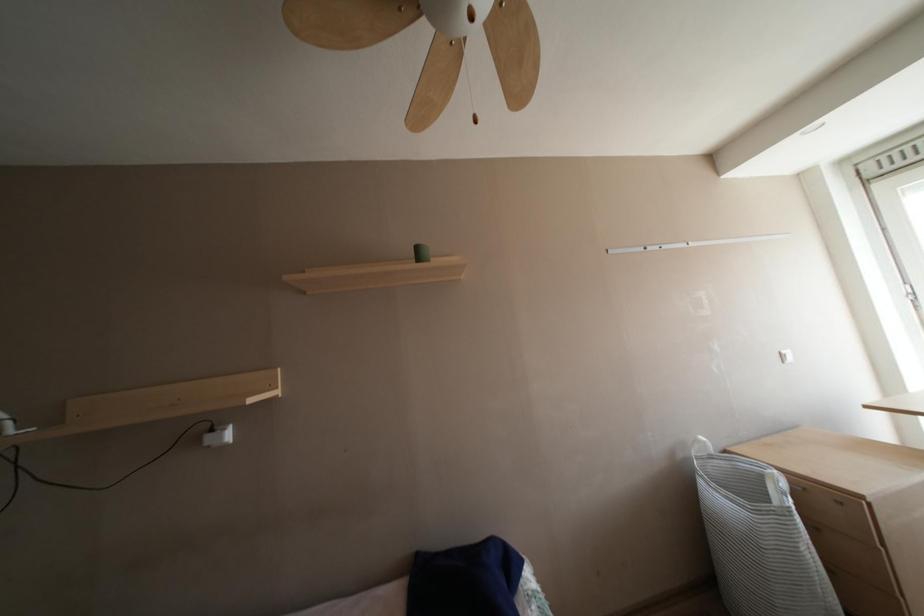
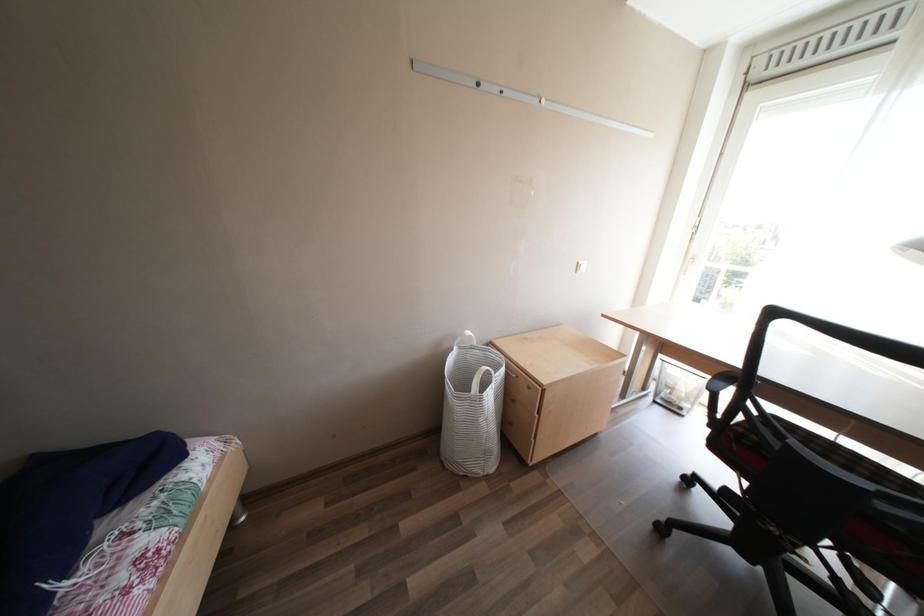
First-person continuous shooting, in which direction is the camera rotating?

The camera rotated toward right-down.